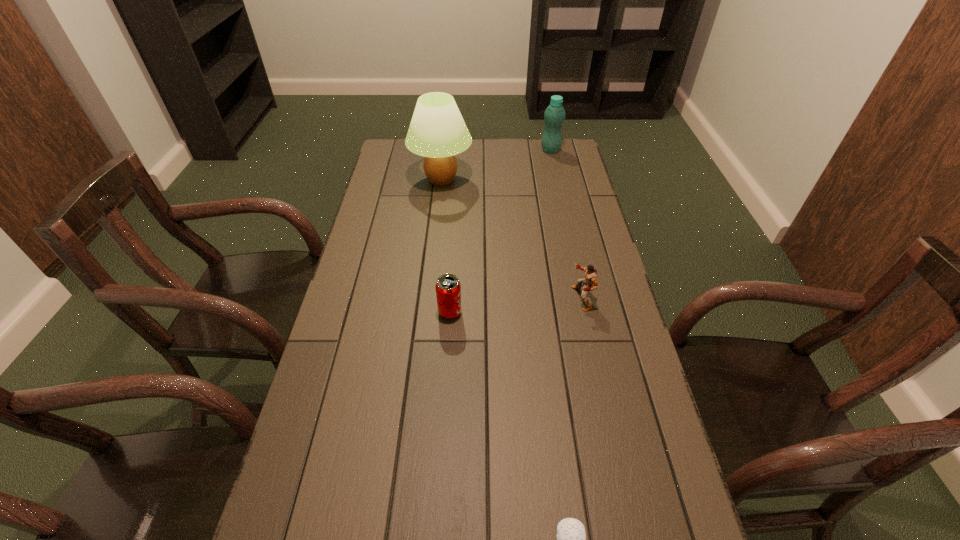
I want to click on vacant space at the left edge, so click(411, 179).

At what (x,y) coordinates should I click in order to perform the action: click on vacant region at the right edge of the desktop. Please return your answer as a coordinate pair (x, y). The width and height of the screenshot is (960, 540). Looking at the image, I should click on (564, 247).

At what (x,y) coordinates should I click in order to perform the action: click on vacant area between the soda can and the tallest object. Please return your answer as a coordinate pair (x, y). This screenshot has width=960, height=540. Looking at the image, I should click on (445, 246).

Find the location of a particular element. The image size is (960, 540). vacant space that is in between the puncher and the water bottle is located at coordinates (566, 224).

At what (x,y) coordinates should I click in order to perform the action: click on free spot between the water bottle and the tallest object. Please return your answer as a coordinate pair (x, y). Image resolution: width=960 pixels, height=540 pixels. Looking at the image, I should click on (496, 165).

Identify the location of free spot between the puncher and the lampshade. The height and width of the screenshot is (540, 960). (512, 239).

Where is `free space between the fourth nearest object and the fourth shortest object`? Image resolution: width=960 pixels, height=540 pixels. free space between the fourth nearest object and the fourth shortest object is located at coordinates (496, 165).

Locate an element on the screen. The height and width of the screenshot is (540, 960). empty space between the second farthest object and the puncher is located at coordinates 512,239.

Where is `free space between the puncher and the soda can`? free space between the puncher and the soda can is located at coordinates (516, 306).

You are a GUI agent. You are given a task and a screenshot of the screen. Output one action in this format:
    pyautogui.click(x=<x>, y=<y>)
    Task: Click on the second closest object relative to the octopus
    
    Given the screenshot: What is the action you would take?
    pyautogui.click(x=590, y=278)